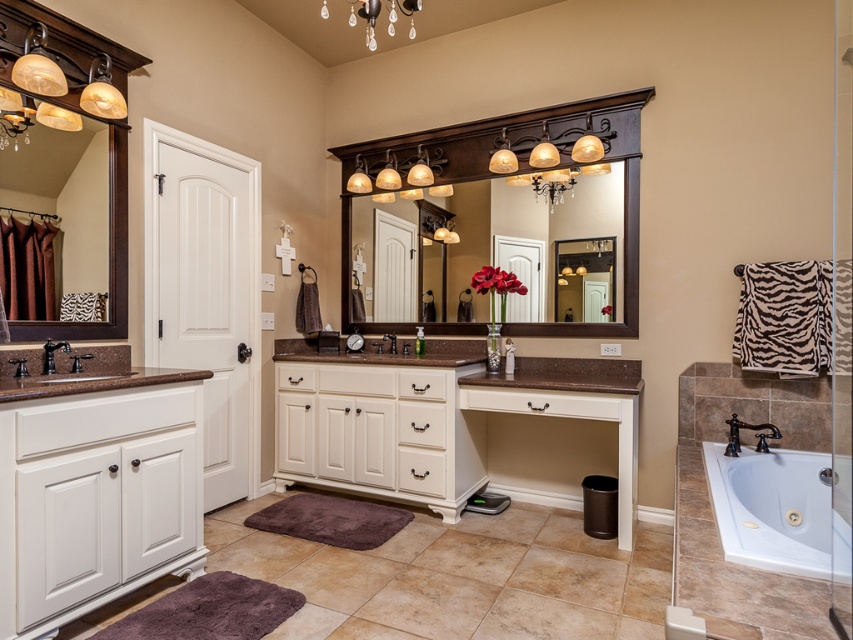
Looking at this image, does white wood vanity at lower left have a greater width compared to blue polished metal faucet at lower right?

Indeed, white wood vanity at lower left has a greater width compared to blue polished metal faucet at lower right.

The image size is (853, 640). What do you see at coordinates (96, 492) in the screenshot?
I see `white wood vanity at lower left` at bounding box center [96, 492].

This screenshot has width=853, height=640. Find the location of `white wood vanity at lower left`. white wood vanity at lower left is located at coordinates tap(96, 492).

Does white wood vanity at lower left have a smaller size compared to black matte faucet at center?

No.

Does white wood vanity at lower left appear on the left side of black matte faucet at center?

Correct, you'll find white wood vanity at lower left to the left of black matte faucet at center.

The width and height of the screenshot is (853, 640). In order to click on white wood vanity at lower left in this screenshot , I will do `click(96, 492)`.

Does wooden mirror at center appear under brown granite sink at left?

Incorrect, wooden mirror at center is not positioned below brown granite sink at left.

Who is lower down, wooden mirror at center or brown granite sink at left?

brown granite sink at left is below.

Which is in front, point (637, 168) or point (32, 374)?

Positioned in front is point (32, 374).

Where is `wooden mirror at center`? This screenshot has height=640, width=853. wooden mirror at center is located at coordinates (515, 170).